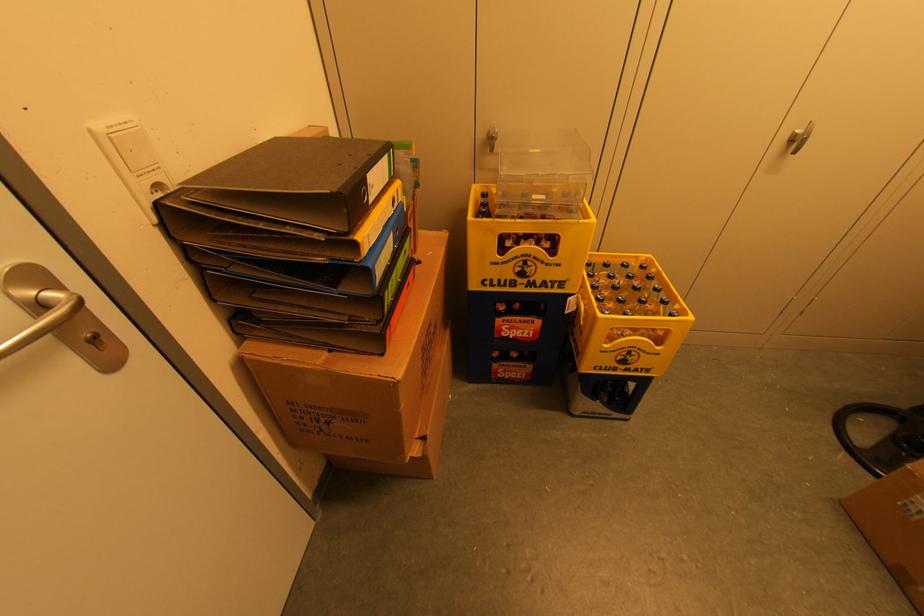
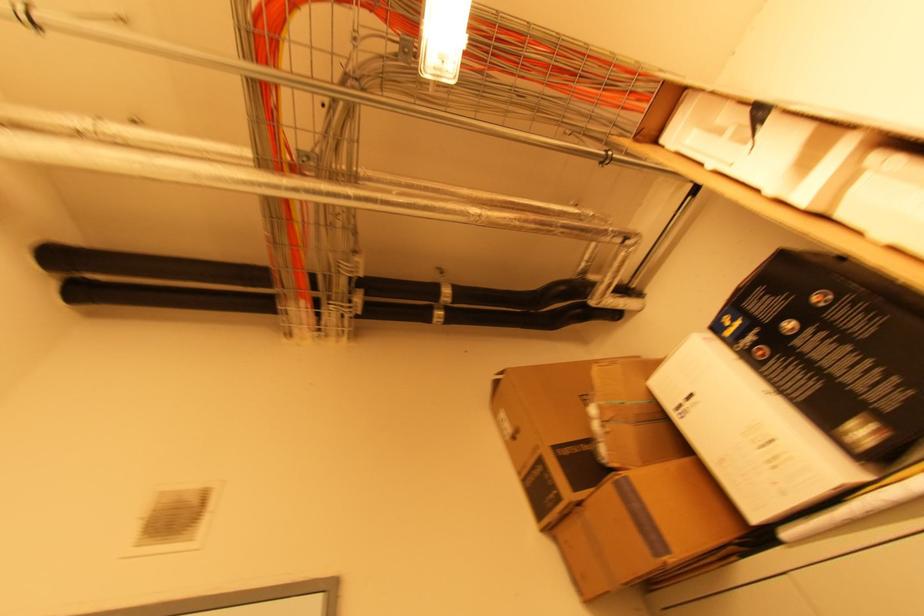
The first image is from the beginning of the video and the second image is from the end. How did the camera likely rotate when shooting the video?

The rotation direction of the camera is left-up.